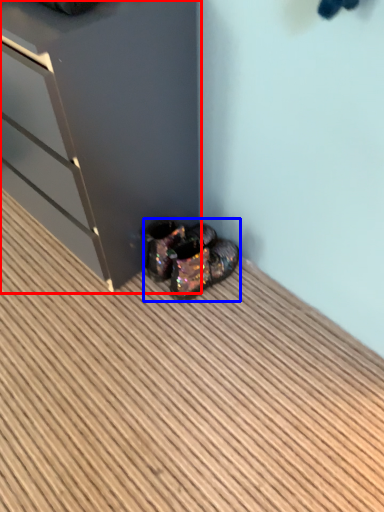
Question: Which object appears closest to the camera in this image, dresser (highlighted by a red box) or footwear (highlighted by a blue box)?

Choices:
 (A) dresser
 (B) footwear

Answer: (A)